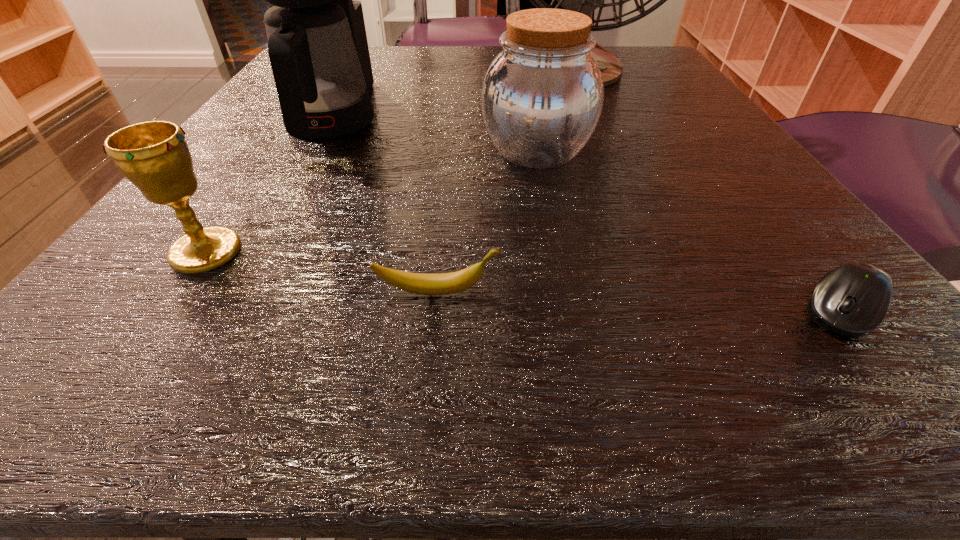
Locate an element on the screen. The height and width of the screenshot is (540, 960). fan is located at coordinates (585, 0).

What are the coordinates of `coffee maker` in the screenshot? It's located at (317, 44).

Identify the location of the third tallest object. (542, 96).

The height and width of the screenshot is (540, 960). Identify the location of the third nearest object. (154, 156).

Locate an element on the screen. This screenshot has height=540, width=960. the third shortest object is located at coordinates (154, 156).

At what (x,y) coordinates should I click in order to perform the action: click on the fifth tallest object. Please return your answer as a coordinate pair (x, y). Looking at the image, I should click on (445, 283).

This screenshot has height=540, width=960. I want to click on the shortest object, so click(851, 300).

The image size is (960, 540). Find the location of `free location located 0.050m in front of the tallest object to direct airflow`. free location located 0.050m in front of the tallest object to direct airflow is located at coordinates (596, 102).

Identify the location of free point located 0.280m pour from the carafe of the coffee maker. The height and width of the screenshot is (540, 960). (226, 310).

Identify the location of vacant space located 0.070m on the front of the fourth shortest object. The image size is (960, 540). (548, 212).